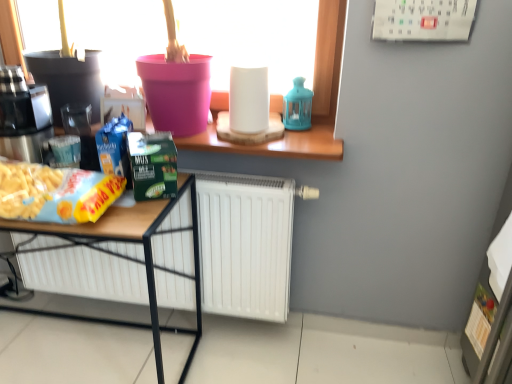
Question: From the image's perspective, does yellow matte snack packet at lower left appear higher than pink plastic bucket at upper center?

Choices:
 (A) yes
 (B) no

Answer: (B)

Question: Is yellow matte snack packet at lower left bigger than pink plastic bucket at upper center?

Choices:
 (A) no
 (B) yes

Answer: (A)

Question: From a real-world perspective, is yellow matte snack packet at lower left on top of pink plastic bucket at upper center?

Choices:
 (A) yes
 (B) no

Answer: (B)

Question: Is yellow matte snack packet at lower left shorter than pink plastic bucket at upper center?

Choices:
 (A) yes
 (B) no

Answer: (A)

Question: Is pink plastic bucket at upper center inside yellow matte snack packet at lower left?

Choices:
 (A) no
 (B) yes

Answer: (A)

Question: Are yellow matte snack packet at lower left and pink plastic bucket at upper center far apart?

Choices:
 (A) no
 (B) yes

Answer: (A)

Question: From a real-world perspective, is brushed metal coffee machine at left on top of wooden desk at lower left?

Choices:
 (A) yes
 (B) no

Answer: (A)

Question: From the image's perspective, is brushed metal coffee machine at left beneath wooden desk at lower left?

Choices:
 (A) yes
 (B) no

Answer: (B)

Question: Are brushed metal coffee machine at left and wooden desk at lower left located far from each other?

Choices:
 (A) yes
 (B) no

Answer: (B)

Question: From the image's perspective, is brushed metal coffee machine at left located above wooden desk at lower left?

Choices:
 (A) yes
 (B) no

Answer: (A)

Question: Is brushed metal coffee machine at left thinner than wooden desk at lower left?

Choices:
 (A) no
 (B) yes

Answer: (B)

Question: Is brushed metal coffee machine at left not within wooden desk at lower left?

Choices:
 (A) yes
 (B) no

Answer: (A)

Question: Can you confirm if wooden desk at lower left is positioned to the left of yellow matte snack packet at lower left?

Choices:
 (A) no
 (B) yes

Answer: (B)